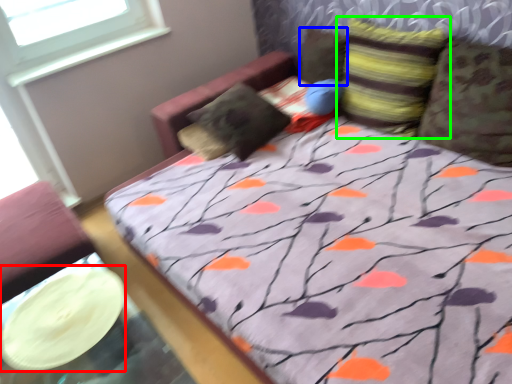
Question: Which object is positioned farthest from platter (highlighted by a red box)? Select from pillow (highlighted by a blue box) and pillow (highlighted by a green box).

Choices:
 (A) pillow
 (B) pillow

Answer: (A)